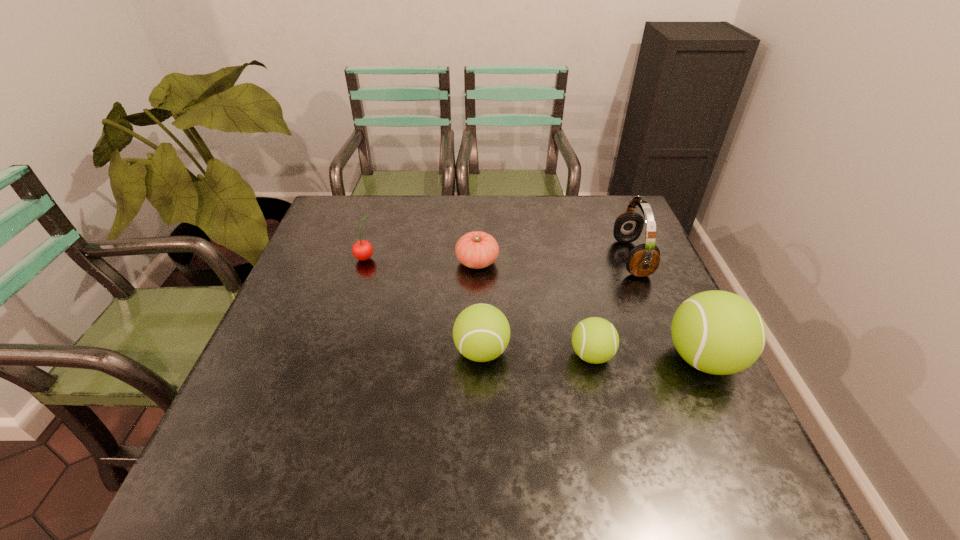
In the current image, all tennis balls are evenly spaced. To maintain this equal spacing, where should an additional tennis ball be placed on the left? Please point out a free spot. Please provide its 2D coordinates. Your answer should be formatted as a tuple, i.e. [(x, y)], where the tuple contains the x and y coordinates of a point satisfying the conditions above.

[(373, 348)]